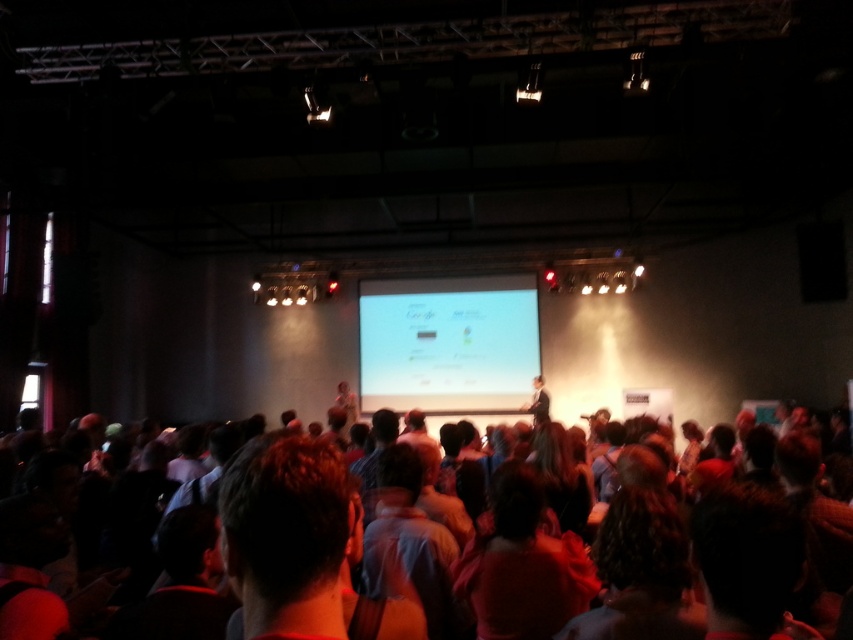
Question: Which point is farther to the camera?

Choices:
 (A) white glossy projection screen at center
 (B) dark red fabric at center
 (C) dark brown hair at center

Answer: (A)

Question: Can you confirm if white glossy projection screen at center is thinner than dark red fabric at center?

Choices:
 (A) no
 (B) yes

Answer: (A)

Question: Based on their relative distances, which object is nearer to the dark red fabric at center?

Choices:
 (A) white glossy projection screen at center
 (B) dark brown hair at center

Answer: (B)

Question: Among these objects, which one is nearest to the camera?

Choices:
 (A) dark brown hair at center
 (B) dark red fabric at center
 (C) white glossy projection screen at center

Answer: (A)

Question: Is white glossy projection screen at center to the right of dark red fabric at center from the viewer's perspective?

Choices:
 (A) yes
 (B) no

Answer: (B)

Question: Does white glossy projection screen at center appear under dark red fabric at center?

Choices:
 (A) no
 (B) yes

Answer: (A)